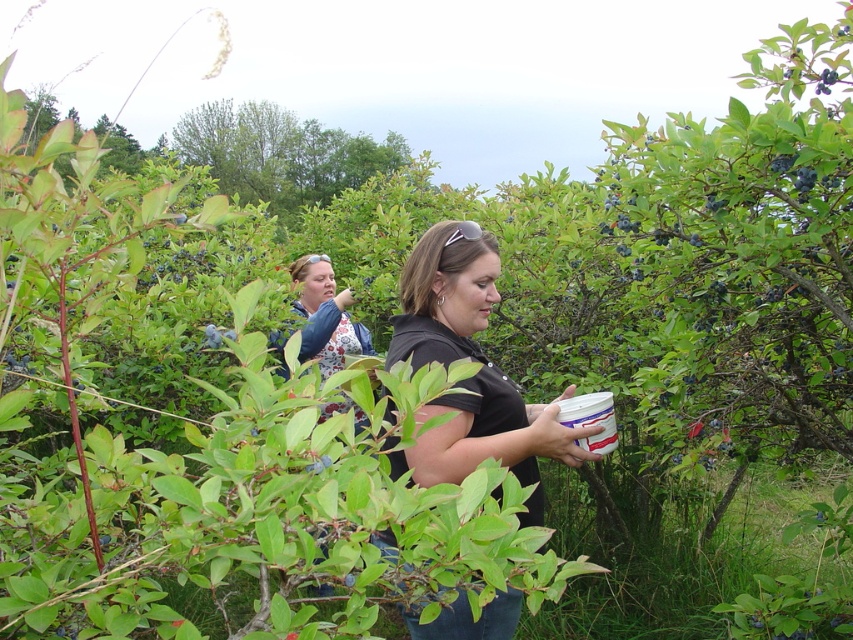
Question: Observing the image, what is the correct spatial positioning of matte black shirt at center in reference to floral-patterned shirt at center?

Choices:
 (A) above
 (B) below

Answer: (B)

Question: Which of the following is the farthest from the observer?

Choices:
 (A) floral-patterned shirt at center
 (B) matte black shirt at center

Answer: (A)

Question: From the image, what is the correct spatial relationship of matte black shirt at center in relation to floral-patterned shirt at center?

Choices:
 (A) right
 (B) left

Answer: (A)

Question: Which point is closer to the camera?

Choices:
 (A) (436, 269)
 (B) (302, 276)

Answer: (A)

Question: Does matte black shirt at center have a smaller size compared to floral-patterned shirt at center?

Choices:
 (A) yes
 (B) no

Answer: (B)